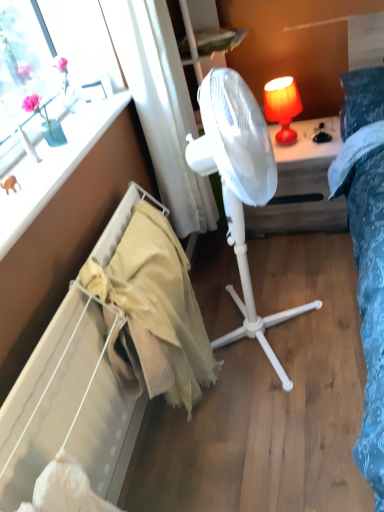
The height and width of the screenshot is (512, 384). Find the location of `vacant space in front of beige cotton blanket at lower left`. vacant space in front of beige cotton blanket at lower left is located at coordinates [231, 466].